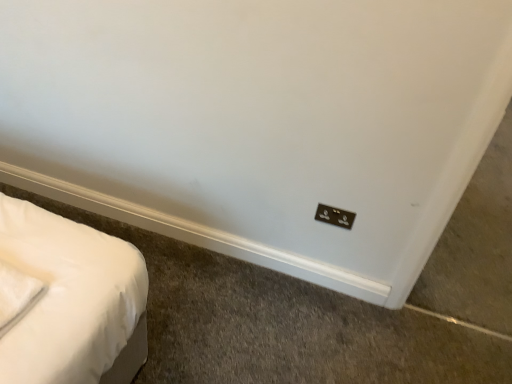
This screenshot has width=512, height=384. Identify the location of black plastic outlet at lower right. (335, 216).

What do you see at coordinates (335, 216) in the screenshot? The image size is (512, 384). I see `black plastic outlet at lower right` at bounding box center [335, 216].

What are the coordinates of `black plastic outlet at lower right` in the screenshot? It's located at (335, 216).